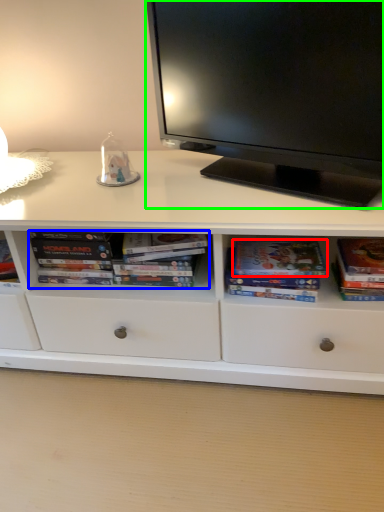
Question: Estimate the real-world distances between objects in this image. Which object is farther from paperback book (highlighted by a red box), book (highlighted by a blue box) or television (highlighted by a green box)?

Choices:
 (A) book
 (B) television

Answer: (B)